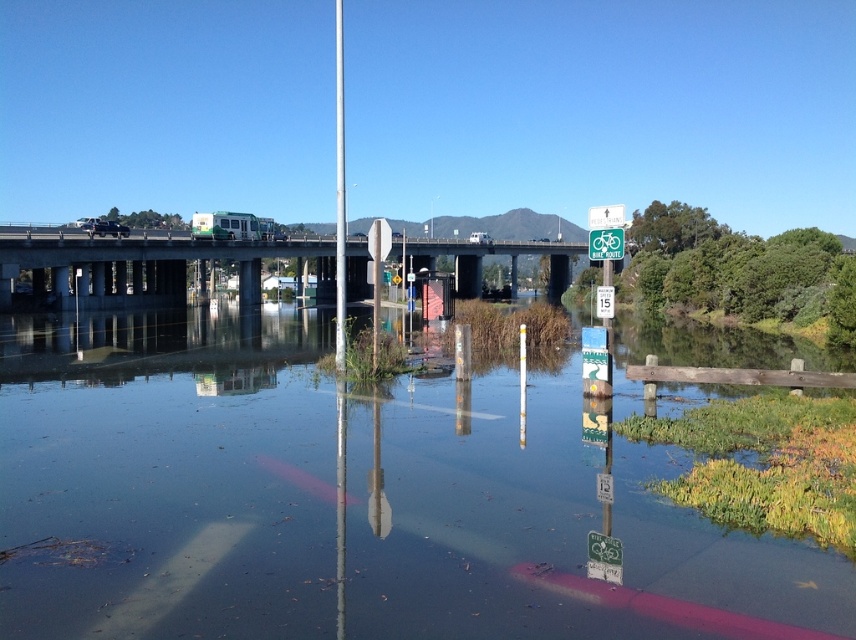
What is the exact location of the clear water at lower center in the image?

The clear water at lower center is located at point (351, 499).

You are a pedestrian trying to cross the flooded area. You see the clear water at lower center and the metallic pole at center. Which object is taller from your viewpoint?

The metallic pole at center is taller than the clear water at lower center.